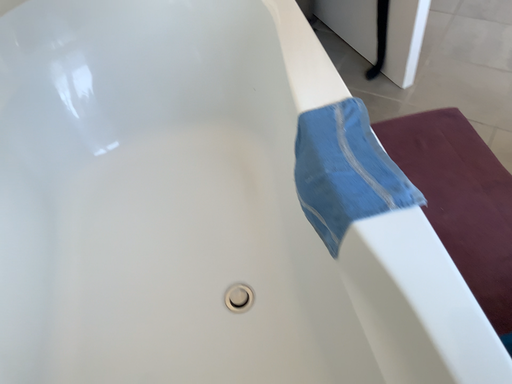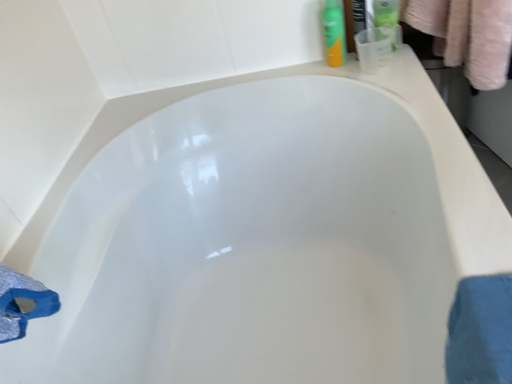
Question: Which way did the camera rotate in the video?

Choices:
 (A) rotated right
 (B) rotated left

Answer: (B)